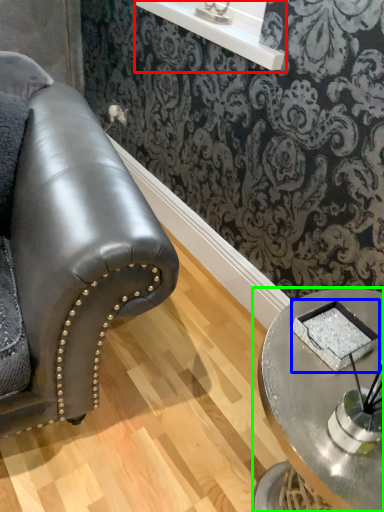
Question: Which is nearer to the window sill (highlighted by a red box)? pad (highlighted by a blue box) or table (highlighted by a green box).

Choices:
 (A) pad
 (B) table

Answer: (B)